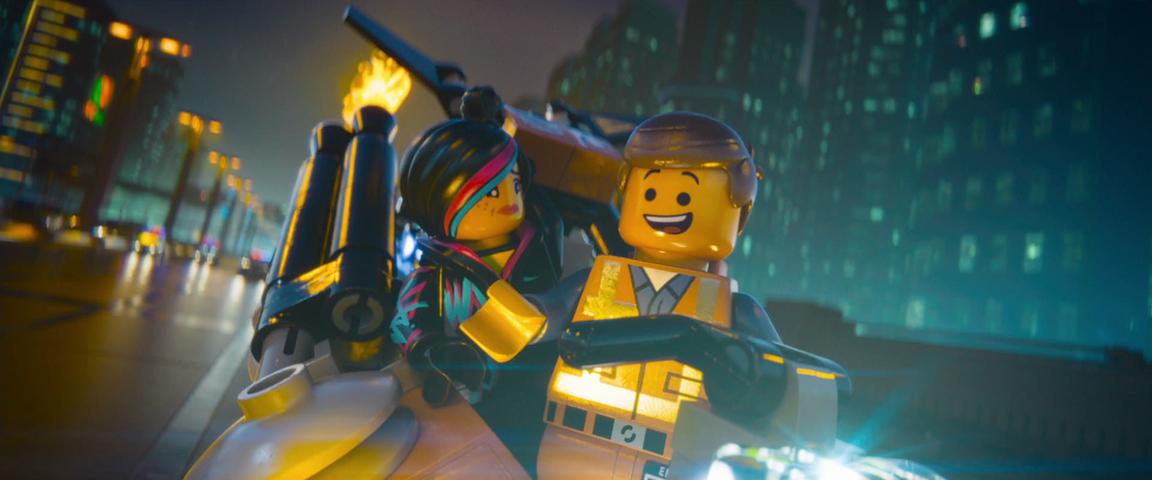
Locate an element on the screen. The image size is (1152, 480). switch is located at coordinates (400, 60).